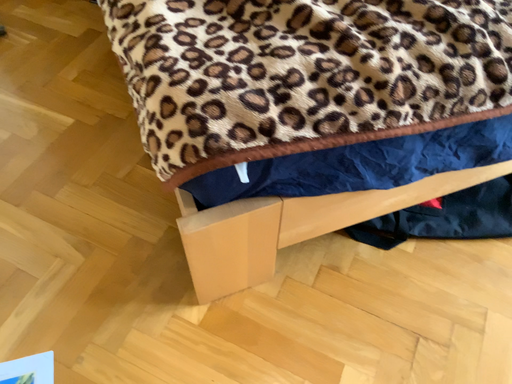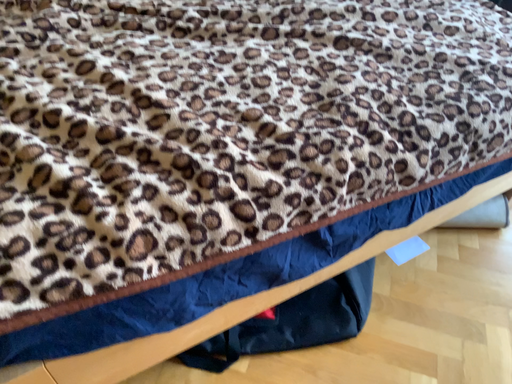
Question: How did the camera likely rotate when shooting the video?

Choices:
 (A) rotated downward
 (B) rotated upward

Answer: (B)